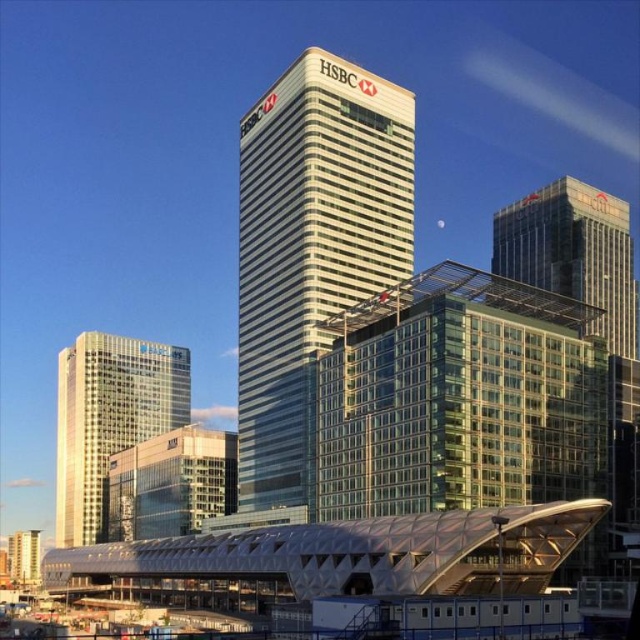
Does white glass skyscraper at center have a lesser height compared to white glass building at left?

Yes, white glass skyscraper at center is shorter than white glass building at left.

Describe the element at coordinates (310, 250) in the screenshot. Image resolution: width=640 pixels, height=640 pixels. I see `white glass skyscraper at center` at that location.

You are a GUI agent. You are given a task and a screenshot of the screen. Output one action in this format:
    pyautogui.click(x=<x>, y=<y>)
    Task: Click on the white glass skyscraper at center
    
    Given the screenshot: What is the action you would take?
    pyautogui.click(x=310, y=250)

Can you confirm if white glass skyscraper at center is bigger than clear glass skyscraper at upper right?

Actually, white glass skyscraper at center might be smaller than clear glass skyscraper at upper right.

Which is more to the left, white glass skyscraper at center or clear glass skyscraper at upper right?

Positioned to the left is white glass skyscraper at center.

Who is more distant from viewer, (308, 214) or (522, 221)?

The point (522, 221) is behind.

Find the location of a particular element. The image size is (640, 640). white glass skyscraper at center is located at coordinates (310, 250).

Locate an element on the screen. This screenshot has height=640, width=640. clear glass skyscraper at upper right is located at coordinates (573, 252).

Between point (538, 193) and point (12, 564), which one is positioned in front?

Point (538, 193)

Between point (586, 248) and point (28, 580), which one is positioned behind?

The point (28, 580) is more distant.

Locate an element on the screen. The width and height of the screenshot is (640, 640). clear glass skyscraper at upper right is located at coordinates (573, 252).